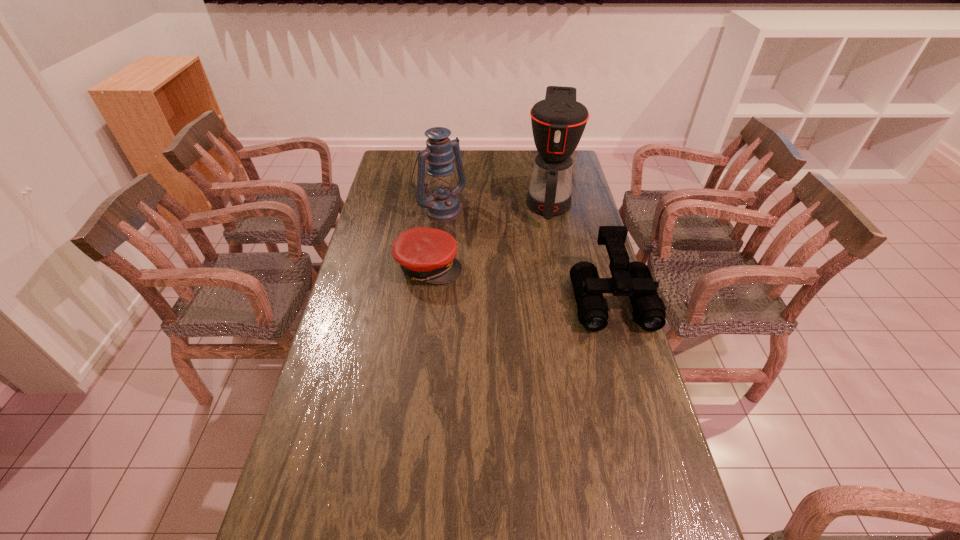
Image resolution: width=960 pixels, height=540 pixels. What are the coordinates of `free region located pour from the carafe of the coffee maker` in the screenshot? It's located at (547, 259).

Where is `free location located 0.160m pour from the carafe of the coffee maker`? free location located 0.160m pour from the carafe of the coffee maker is located at coordinates (547, 257).

Where is `object positioned at the far edge`? object positioned at the far edge is located at coordinates (558, 122).

The width and height of the screenshot is (960, 540). I want to click on object positioned at the left edge, so click(425, 254).

You are a GUI agent. You are given a task and a screenshot of the screen. Output one action in this format:
    pyautogui.click(x=<x>, y=<y>)
    Task: Click on the binoculars situated at the right edge
    The image size is (960, 540).
    Given the screenshot: What is the action you would take?
    pyautogui.click(x=633, y=279)

Locate an element on the screen. The height and width of the screenshot is (540, 960). coffee maker positioned at the right edge is located at coordinates click(558, 122).

The width and height of the screenshot is (960, 540). Identify the location of object at the far right corner. (558, 122).

Find the location of a particular element. Image resolution: width=960 pixels, height=540 pixels. blank space at the far edge of the desktop is located at coordinates (492, 166).

What are the coordinates of `vacant space at the near edge of the desktop` in the screenshot? It's located at (580, 534).

Locate an element on the screen. free space at the left edge is located at coordinates (355, 256).